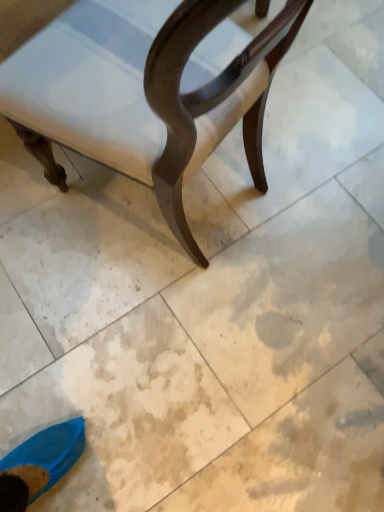
Question: Should I look upward or downward to see glossy wood chair at upper center?

Choices:
 (A) up
 (B) down

Answer: (A)